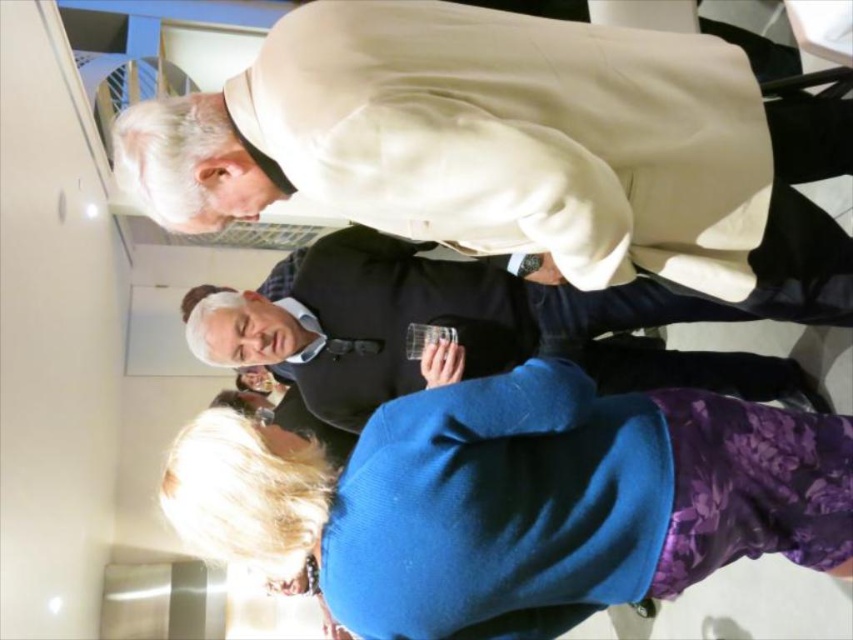
Question: Which point is closer to the camera taking this photo?

Choices:
 (A) (566, 26)
 (B) (364, 262)

Answer: (A)

Question: Is light beige fabric coat at upper center to the left of blue woolen sweater at lower center from the viewer's perspective?

Choices:
 (A) no
 (B) yes

Answer: (B)

Question: Which of these objects is positioned closest to the light beige fabric coat at upper center?

Choices:
 (A) matte black vest at center
 (B) blue woolen sweater at lower center

Answer: (B)

Question: Estimate the real-world distances between objects in this image. Which object is closer to the matte black vest at center?

Choices:
 (A) light beige fabric coat at upper center
 (B) blue woolen sweater at lower center

Answer: (A)

Question: Can you confirm if blue woolen sweater at lower center is positioned to the right of matte black vest at center?

Choices:
 (A) yes
 (B) no

Answer: (B)

Question: Does blue woolen sweater at lower center have a lesser width compared to matte black vest at center?

Choices:
 (A) yes
 (B) no

Answer: (A)